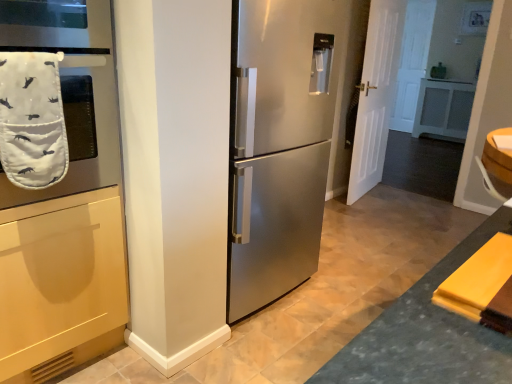
Find the location of a particular element. empty space that is to the right of stainless steel refrigerator at center is located at coordinates (346, 281).